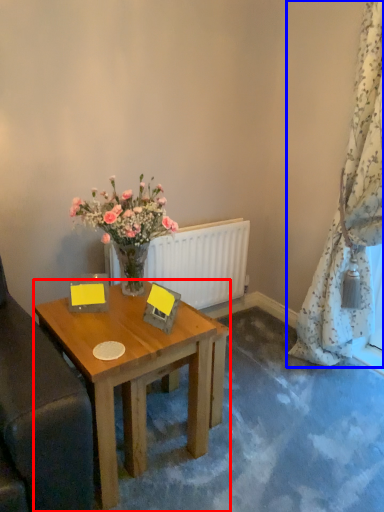
Question: Which point is closer to the camera, desk (highlighted by a red box) or curtain (highlighted by a blue box)?

Choices:
 (A) desk
 (B) curtain

Answer: (A)